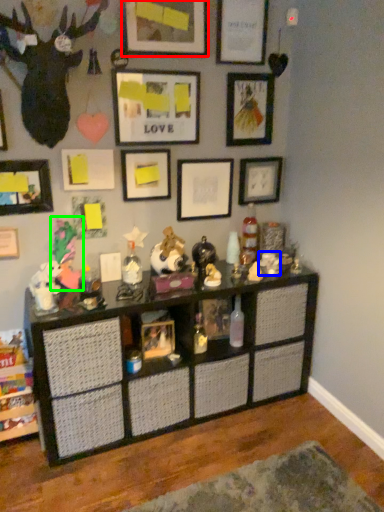
Question: Based on their relative distances, which object is farther from picture frame (highlighted by a red box)? Choose from toy (highlighted by a blue box) and toy (highlighted by a green box).

Choices:
 (A) toy
 (B) toy

Answer: (A)